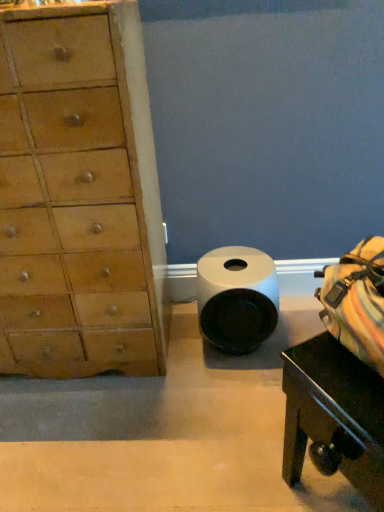
Locate an element on the screen. The width and height of the screenshot is (384, 512). vacant space positioned to the left of white matte toilet paper at center is located at coordinates (173, 357).